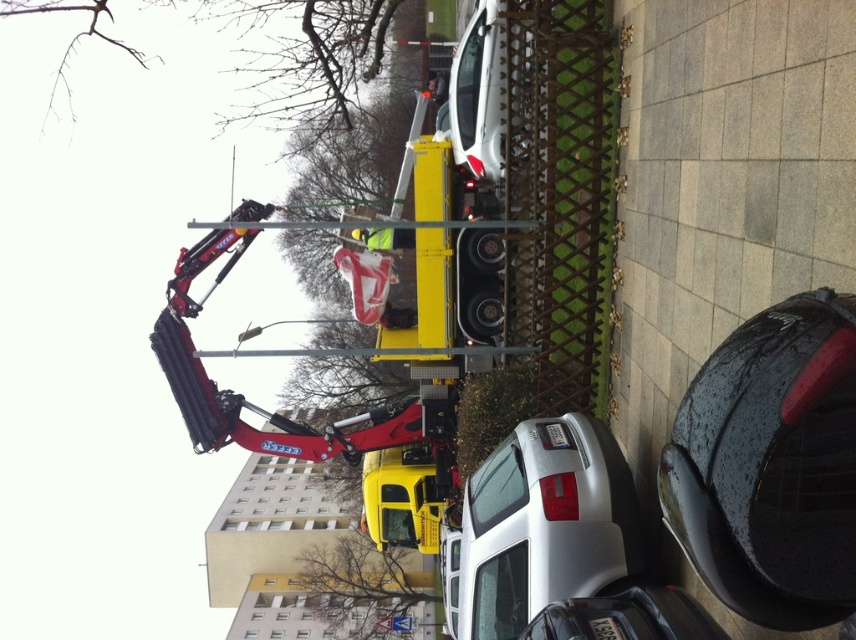
Can you confirm if satin silver car at center is positioned below yellow matte truck at center?

No.

Between satin silver car at center and yellow matte truck at center, which one appears on the right side from the viewer's perspective?

From the viewer's perspective, satin silver car at center appears more on the right side.

Is point (521, 433) farther from viewer compared to point (415, 476)?

That is False.

This screenshot has height=640, width=856. What are the coordinates of `satin silver car at center` in the screenshot? It's located at (544, 524).